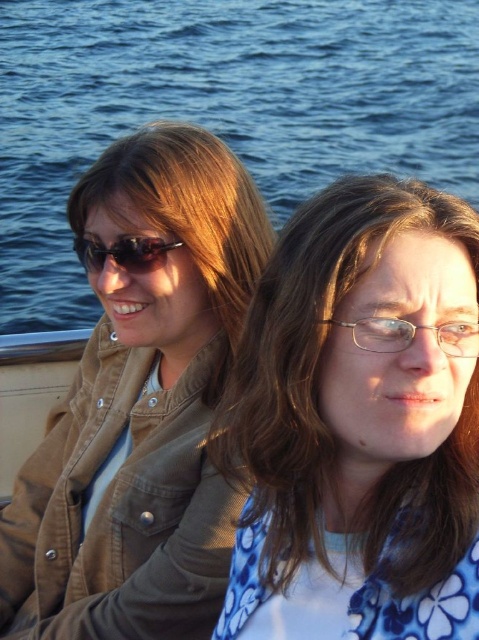
Question: Is blue floral shirt at center further to the viewer compared to blue water at upper center?

Choices:
 (A) no
 (B) yes

Answer: (A)

Question: Among these objects, which one is nearest to the camera?

Choices:
 (A) blue water at upper center
 (B) blue floral shirt at center

Answer: (B)

Question: Is blue floral shirt at center closer to camera compared to blue water at upper center?

Choices:
 (A) yes
 (B) no

Answer: (A)

Question: Which of the following is the farthest from the observer?

Choices:
 (A) (135, 237)
 (B) (351, 33)

Answer: (B)

Question: Among these points, which one is nearest to the camera?

Choices:
 (A) (251, 214)
 (B) (328, 536)
 (C) (25, 204)
 (D) (86, 240)

Answer: (B)

Question: Considering the relative positions of blue water at upper center and black plastic sunglasses at upper left in the image provided, where is blue water at upper center located with respect to black plastic sunglasses at upper left?

Choices:
 (A) left
 (B) right

Answer: (A)